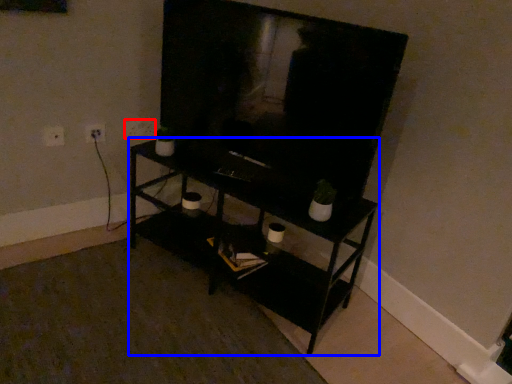
Question: Which object is closer to the camera taking this photo, electric outlet (highlighted by a red box) or shelf (highlighted by a blue box)?

Choices:
 (A) electric outlet
 (B) shelf

Answer: (B)